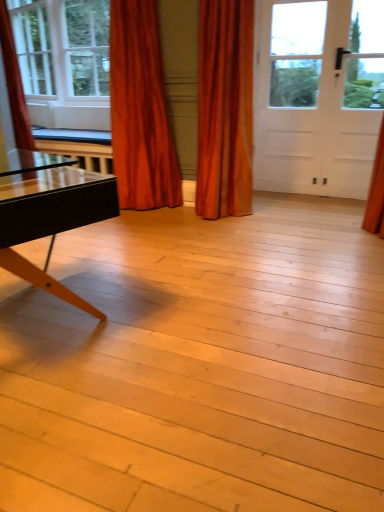
Locate an element on the screen. The width and height of the screenshot is (384, 512). white matte door at upper right is located at coordinates (317, 95).

The image size is (384, 512). What do you see at coordinates (317, 95) in the screenshot? I see `white matte door at upper right` at bounding box center [317, 95].

I want to click on clear glass window at upper left, so click(x=62, y=47).

What do you see at coordinates (140, 110) in the screenshot?
I see `satin orange curtain at upper left, positioned as the second curtain in right-to-left order` at bounding box center [140, 110].

Locate an element on the screen. white matte door at upper right is located at coordinates (317, 95).

Identify the location of the 1st curtain to the right when counting from the velvet orange curtain at left, which appears as the third curtain when viewed from the right. The width and height of the screenshot is (384, 512). (140, 110).

From the image's perspective, which one is positioned lower, satin orange curtain at upper left, arranged as the 2th curtain when viewed from the left, or velvet orange curtain at left, which appears as the first curtain when viewed from the left?

satin orange curtain at upper left, arranged as the 2th curtain when viewed from the left, is shown below in the image.

Between satin orange curtain at upper left, positioned as the second curtain in right-to-left order, and velvet orange curtain at left, which appears as the third curtain when viewed from the right, which one appears on the left side from the viewer's perspective?

From the viewer's perspective, velvet orange curtain at left, which appears as the third curtain when viewed from the right, appears more on the left side.

Is there a large distance between satin orange curtain at upper left, positioned as the second curtain in right-to-left order, and velvet orange curtain at left, which appears as the first curtain when viewed from the left?

Actually, satin orange curtain at upper left, positioned as the second curtain in right-to-left order, and velvet orange curtain at left, which appears as the first curtain when viewed from the left, are a little close together.

Who is smaller, clear glass window at upper left or velvet orange curtain at center, which is the first curtain from right to left?

With smaller size is velvet orange curtain at center, which is the first curtain from right to left.

Which of these two, clear glass window at upper left or velvet orange curtain at center, which is the third curtain from left to right, stands taller?

velvet orange curtain at center, which is the third curtain from left to right.

Which point is more distant from viewer, (53, 70) or (198, 145)?

Positioned behind is point (53, 70).

Is clear glass window at upper left positioned beyond the bounds of velvet orange curtain at center, which is the third curtain from left to right?

Yes, clear glass window at upper left is not within velvet orange curtain at center, which is the third curtain from left to right.

Is white matte door at upper right to the right of satin orange curtain at upper left, positioned as the second curtain in right-to-left order, from the viewer's perspective?

Yes, white matte door at upper right is to the right of satin orange curtain at upper left, positioned as the second curtain in right-to-left order.

Is white matte door at upper right turned away from satin orange curtain at upper left, positioned as the second curtain in right-to-left order?

No.

From a real-world perspective, which object rests below the other?

satin orange curtain at upper left, arranged as the 2th curtain when viewed from the left.

Considering the relative sizes of white matte door at upper right and satin orange curtain at upper left, arranged as the 2th curtain when viewed from the left, in the image provided, is white matte door at upper right thinner than satin orange curtain at upper left, arranged as the 2th curtain when viewed from the left,?

Correct, the width of white matte door at upper right is less than that of satin orange curtain at upper left, arranged as the 2th curtain when viewed from the left.

Consider the image. Who is smaller, velvet orange curtain at left, which appears as the first curtain when viewed from the left, or satin orange curtain at upper left, arranged as the 2th curtain when viewed from the left?

velvet orange curtain at left, which appears as the first curtain when viewed from the left.

How many degrees apart are the facing directions of velvet orange curtain at left, which appears as the first curtain when viewed from the left, and satin orange curtain at upper left, positioned as the second curtain in right-to-left order?

The angle between the facing direction of velvet orange curtain at left, which appears as the first curtain when viewed from the left, and the facing direction of satin orange curtain at upper left, positioned as the second curtain in right-to-left order, is 0.000236 degrees.

The width and height of the screenshot is (384, 512). I want to click on the 1st curtain in front of the velvet orange curtain at left, which appears as the third curtain when viewed from the right, so click(140, 110).

Can you confirm if velvet orange curtain at left, which appears as the first curtain when viewed from the left, is thinner than satin orange curtain at upper left, positioned as the second curtain in right-to-left order?

Yes.

Who is smaller, clear glass window at upper left or satin orange curtain at upper left, arranged as the 2th curtain when viewed from the left?

satin orange curtain at upper left, arranged as the 2th curtain when viewed from the left.

Looking at this image, considering the relative positions of clear glass window at upper left and satin orange curtain at upper left, arranged as the 2th curtain when viewed from the left, in the image provided, is clear glass window at upper left to the left of satin orange curtain at upper left, arranged as the 2th curtain when viewed from the left, from the viewer's perspective?

Yes.

Is velvet orange curtain at center, which is the first curtain from right to left, positioned far away from white matte door at upper right?

No, velvet orange curtain at center, which is the first curtain from right to left, is in close proximity to white matte door at upper right.

Does velvet orange curtain at center, which is the first curtain from right to left, have a lesser height compared to white matte door at upper right?

Indeed, velvet orange curtain at center, which is the first curtain from right to left, has a lesser height compared to white matte door at upper right.

Measure the distance from velvet orange curtain at center, which is the third curtain from left to right, to white matte door at upper right.

32.61 inches.

How many degrees apart are the facing directions of velvet orange curtain at center, which is the third curtain from left to right, and white matte door at upper right?

There is a 0.806-degree angle between the facing directions of velvet orange curtain at center, which is the third curtain from left to right, and white matte door at upper right.

Is satin orange curtain at upper left, arranged as the 2th curtain when viewed from the left, to the right of velvet orange curtain at center, which is the first curtain from right to left, from the viewer's perspective?

No.

From the image's perspective, does satin orange curtain at upper left, arranged as the 2th curtain when viewed from the left, appear lower than velvet orange curtain at center, which is the first curtain from right to left?

Incorrect, from the image's perspective, satin orange curtain at upper left, arranged as the 2th curtain when viewed from the left, is higher than velvet orange curtain at center, which is the first curtain from right to left.

In terms of size, does satin orange curtain at upper left, positioned as the second curtain in right-to-left order, appear bigger or smaller than velvet orange curtain at center, which is the third curtain from left to right?

In the image, satin orange curtain at upper left, positioned as the second curtain in right-to-left order, appears to be larger than velvet orange curtain at center, which is the third curtain from left to right.

Which point is more forward, (x=123, y=5) or (x=222, y=84)?

The point (x=222, y=84) is closer.

This screenshot has height=512, width=384. What are the coordinates of `curtain on the left of the satin orange curtain at upper left, positioned as the second curtain in right-to-left order` in the screenshot? It's located at (14, 83).

The width and height of the screenshot is (384, 512). Find the location of `window behind the velvet orange curtain at center, which is the first curtain from right to left`. window behind the velvet orange curtain at center, which is the first curtain from right to left is located at coordinates (62, 47).

Based on their spatial positions, is velvet orange curtain at left, which appears as the third curtain when viewed from the right, or velvet orange curtain at center, which is the first curtain from right to left, closer to white matte door at upper right?

velvet orange curtain at center, which is the first curtain from right to left.

Consider the image. Which object lies further to the anchor point satin orange curtain at upper left, arranged as the 2th curtain when viewed from the left, white matte door at upper right or clear glass window at upper left?

Among the two, clear glass window at upper left is located further to satin orange curtain at upper left, arranged as the 2th curtain when viewed from the left.

Estimate the real-world distances between objects in this image. Which object is further from clear glass window at upper left, satin orange curtain at upper left, positioned as the second curtain in right-to-left order, or velvet orange curtain at left, which appears as the third curtain when viewed from the right?

Among the two, satin orange curtain at upper left, positioned as the second curtain in right-to-left order, is located further to clear glass window at upper left.

Looking at the image, which one is located further to white matte door at upper right, satin orange curtain at upper left, positioned as the second curtain in right-to-left order, or clear glass window at upper left?

clear glass window at upper left.

Looking at the image, which one is located further to velvet orange curtain at center, which is the third curtain from left to right, clear glass window at upper left or white matte door at upper right?

clear glass window at upper left lies further to velvet orange curtain at center, which is the third curtain from left to right, than the other object.

Which object lies nearer to the anchor point velvet orange curtain at left, which appears as the third curtain when viewed from the right, clear glass window at upper left or white matte door at upper right?

clear glass window at upper left.

Estimate the real-world distances between objects in this image. Which object is further from satin orange curtain at upper left, arranged as the 2th curtain when viewed from the left, clear glass window at upper left or velvet orange curtain at left, which appears as the third curtain when viewed from the right?

clear glass window at upper left is positioned further to the anchor satin orange curtain at upper left, arranged as the 2th curtain when viewed from the left.

Looking at the image, which one is located further to satin orange curtain at upper left, arranged as the 2th curtain when viewed from the left, clear glass window at upper left or velvet orange curtain at center, which is the first curtain from right to left?

clear glass window at upper left lies further to satin orange curtain at upper left, arranged as the 2th curtain when viewed from the left, than the other object.

Identify the location of curtain between velvet orange curtain at left, which appears as the third curtain when viewed from the right, and velvet orange curtain at center, which is the third curtain from left to right, in the horizontal direction. Image resolution: width=384 pixels, height=512 pixels. (140, 110).

At what (x,y) coordinates should I click in order to perform the action: click on curtain located between satin orange curtain at upper left, arranged as the 2th curtain when viewed from the left, and white matte door at upper right in the left-right direction. Please return your answer as a coordinate pair (x, y). The image size is (384, 512). Looking at the image, I should click on (225, 109).

Image resolution: width=384 pixels, height=512 pixels. In order to click on curtain between clear glass window at upper left and satin orange curtain at upper left, arranged as the 2th curtain when viewed from the left, in the horizontal direction in this screenshot , I will do `click(14, 83)`.